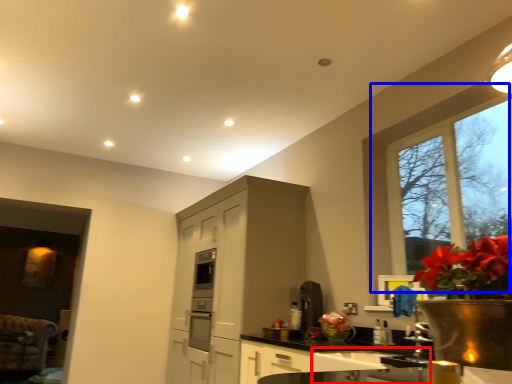
Question: Which point is further to the camera, sink (highlighted by a red box) or window (highlighted by a blue box)?

Choices:
 (A) sink
 (B) window

Answer: (B)